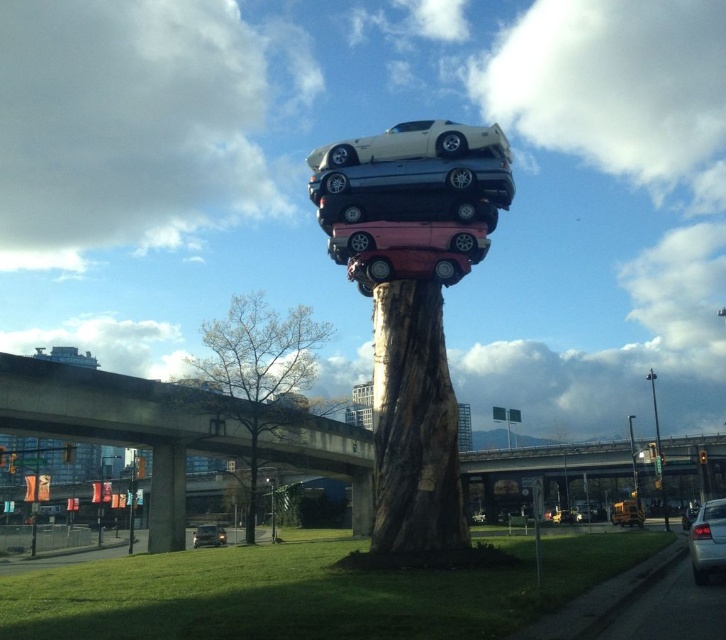
Who is more forward, (674,456) or (240,298)?

Positioned in front is point (240,298).

Is point (77, 438) positioned before point (280, 365)?

No, (77, 438) is behind (280, 365).

Locate an element on the screen. concrete bridge at lower left is located at coordinates [115, 408].

Who is more forward, (220,401) or (650,381)?

Point (220,401) is in front.

Can you confirm if concrete bridge at lower left is wider than metallic pole at center-right?

Yes, concrete bridge at lower left is wider than metallic pole at center-right.

Where is `concrete bridge at lower left`? This screenshot has height=640, width=726. concrete bridge at lower left is located at coordinates (115, 408).

This screenshot has width=726, height=640. Identify the location of concrete bridge at lower left. (115, 408).

Can you confirm if matte black sedan at lower right is positioned to the right of metallic pole at center-right?

Incorrect, matte black sedan at lower right is not on the right side of metallic pole at center-right.

Which is below, matte black sedan at lower right or metallic pole at center-right?

metallic pole at center-right

Is point (725, 525) behind point (660, 456)?

No.

The height and width of the screenshot is (640, 726). Identify the location of matte black sedan at lower right. (709, 540).